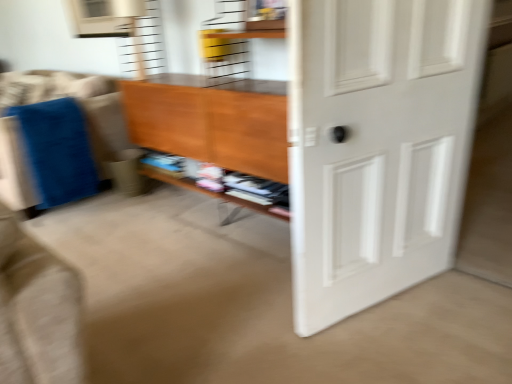
Question: Considering the relative positions of wooden shelf at center and white matte door at right in the image provided, is wooden shelf at center to the right of white matte door at right from the viewer's perspective?

Choices:
 (A) no
 (B) yes

Answer: (A)

Question: Is wooden shelf at center facing away from white matte door at right?

Choices:
 (A) no
 (B) yes

Answer: (A)

Question: Are wooden shelf at center and white matte door at right far apart?

Choices:
 (A) no
 (B) yes

Answer: (A)

Question: Considering the relative sizes of wooden shelf at center and white matte door at right in the image provided, is wooden shelf at center smaller than white matte door at right?

Choices:
 (A) no
 (B) yes

Answer: (B)

Question: Is white matte door at right a part of wooden shelf at center?

Choices:
 (A) no
 (B) yes

Answer: (A)

Question: Does wooden shelf at center come behind white matte door at right?

Choices:
 (A) yes
 (B) no

Answer: (A)

Question: Is wooden shelf at center surrounded by white matte door at right?

Choices:
 (A) yes
 (B) no

Answer: (B)

Question: From the image's perspective, does white matte door at right appear higher than wooden shelf at center?

Choices:
 (A) yes
 (B) no

Answer: (B)

Question: Is white matte door at right not close to wooden shelf at center?

Choices:
 (A) no
 (B) yes

Answer: (A)

Question: From the image's perspective, would you say white matte door at right is shown under wooden shelf at center?

Choices:
 (A) yes
 (B) no

Answer: (A)

Question: Can you see white matte door at right touching wooden shelf at center?

Choices:
 (A) yes
 (B) no

Answer: (B)

Question: From a real-world perspective, is white matte door at right physically above wooden shelf at center?

Choices:
 (A) no
 (B) yes

Answer: (B)

Question: Looking at their shapes, would you say white matte door at right is wider or thinner than wooden shelf at center?

Choices:
 (A) thin
 (B) wide

Answer: (A)